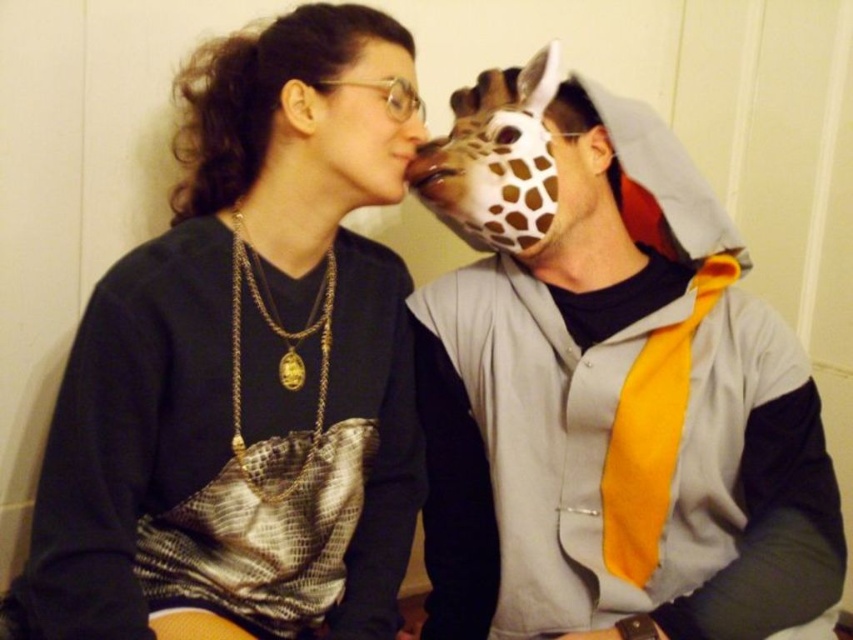
Question: Which point is closer to the camera taking this photo?

Choices:
 (A) (373, 186)
 (B) (155, 360)
 (C) (573, 397)

Answer: (B)

Question: Considering the relative positions of matte gray hoodie at center and matte black face at upper left in the image provided, where is matte gray hoodie at center located with respect to matte black face at upper left?

Choices:
 (A) above
 (B) below

Answer: (B)

Question: Which object is positioned farthest from the matte gray hoodie at center?

Choices:
 (A) matte black sweater at upper left
 (B) matte black face at upper left

Answer: (B)

Question: In this image, where is matte gray hoodie at center located relative to matte black face at upper left?

Choices:
 (A) below
 (B) above

Answer: (A)

Question: Which of these objects is positioned closest to the matte black face at upper left?

Choices:
 (A) matte black sweater at upper left
 (B) matte gray hoodie at center

Answer: (A)

Question: Observing the image, what is the correct spatial positioning of matte black sweater at upper left in reference to matte black face at upper left?

Choices:
 (A) left
 (B) right

Answer: (A)